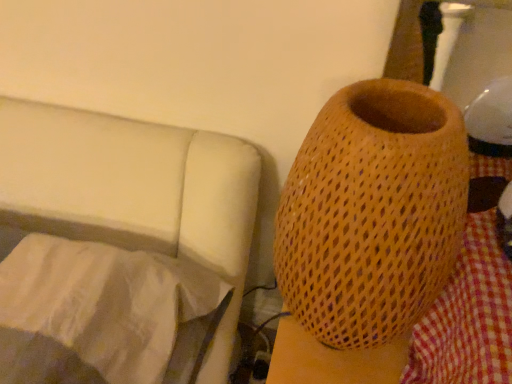
Question: In terms of size, does brown woven vase at right appear bigger or smaller than white fabric at lower left?

Choices:
 (A) small
 (B) big

Answer: (A)

Question: Is brown woven vase at right in front of or behind white fabric at lower left in the image?

Choices:
 (A) behind
 (B) front

Answer: (B)

Question: Would you say brown woven vase at right is inside or outside white fabric at lower left?

Choices:
 (A) inside
 (B) outside

Answer: (B)

Question: Is white fabric at lower left to the left or to the right of brown woven vase at right in the image?

Choices:
 (A) left
 (B) right

Answer: (A)

Question: Is white fabric at lower left taller or shorter than brown woven vase at right?

Choices:
 (A) tall
 (B) short

Answer: (B)

Question: Considering the positions of white fabric at lower left and brown woven vase at right in the image, is white fabric at lower left wider or thinner than brown woven vase at right?

Choices:
 (A) thin
 (B) wide

Answer: (B)

Question: Would you say white fabric at lower left is inside or outside brown woven vase at right?

Choices:
 (A) inside
 (B) outside

Answer: (B)